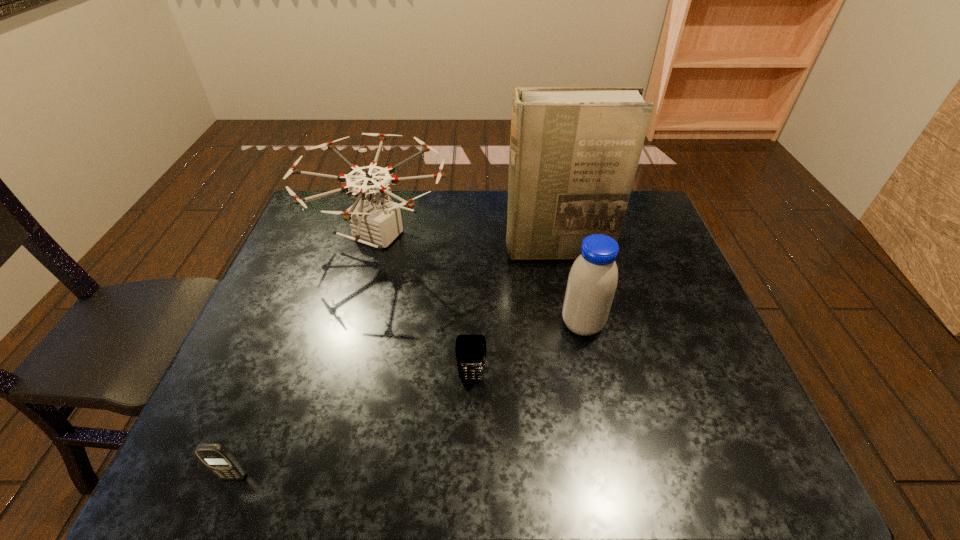
Where is `the tallest object`? The width and height of the screenshot is (960, 540). the tallest object is located at coordinates pos(574,151).

Locate an element on the screen. Image resolution: width=960 pixels, height=540 pixels. drone is located at coordinates (374, 221).

Where is `the third nearest object`? The height and width of the screenshot is (540, 960). the third nearest object is located at coordinates (592, 282).

Locate an element on the screen. The width and height of the screenshot is (960, 540). the fourth farthest object is located at coordinates (470, 349).

Locate an element on the screen. This screenshot has height=540, width=960. the taller cellular telephone is located at coordinates (470, 349).

The width and height of the screenshot is (960, 540). I want to click on the shortest object, so click(x=217, y=458).

At what (x,y) coordinates should I click in order to perform the action: click on the nearest object. Please return your answer as a coordinate pair (x, y). The width and height of the screenshot is (960, 540). Looking at the image, I should click on pyautogui.click(x=217, y=458).

I want to click on vacant area situated 0.400m on the cover of the phonebook, so click(582, 378).

At what (x,y) coordinates should I click in order to perform the action: click on blank area located on the front of the drone. Please return your answer as a coordinate pair (x, y). The width and height of the screenshot is (960, 540). Looking at the image, I should click on (352, 339).

Identify the location of vacant space located 0.150m on the front of the third nearest object. Image resolution: width=960 pixels, height=540 pixels. (597, 395).